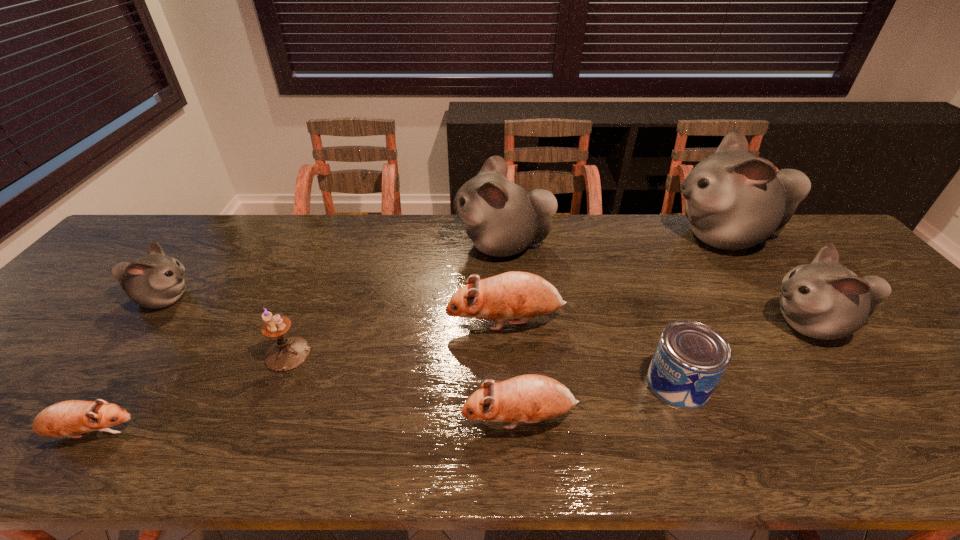
The image size is (960, 540). What are the coordinates of `the tallest object` in the screenshot? It's located at (734, 200).

At what (x,y) coordinates should I click in order to perform the action: click on the biggest white hamster. Please return your answer as a coordinate pair (x, y). Looking at the image, I should click on (734, 200).

Identify the location of the second tallest hamster. (502, 219).

The image size is (960, 540). Identify the location of the third white hamster from right to left. (502, 219).

You are a GUI agent. You are given a task and a screenshot of the screen. Output one action in this format:
    pyautogui.click(x=<x>, y=<y>)
    Task: Click on the fifth shortest hamster
    This screenshot has height=540, width=960.
    Given the screenshot: What is the action you would take?
    tap(824, 300)

Identify the location of the third tallest object. This screenshot has height=540, width=960. (x=824, y=300).

You are a GUI agent. You are given a task and a screenshot of the screen. Output one action in this format:
    pyautogui.click(x=<x>, y=<y>)
    Task: Click on the smallest white hamster
    
    Given the screenshot: What is the action you would take?
    pyautogui.click(x=154, y=281)

I want to click on candle holder, so click(x=286, y=354).

Identify the location of the third object from left to right. (286, 354).

Locate an element on the screen. the farthest brown hamster is located at coordinates (511, 295).